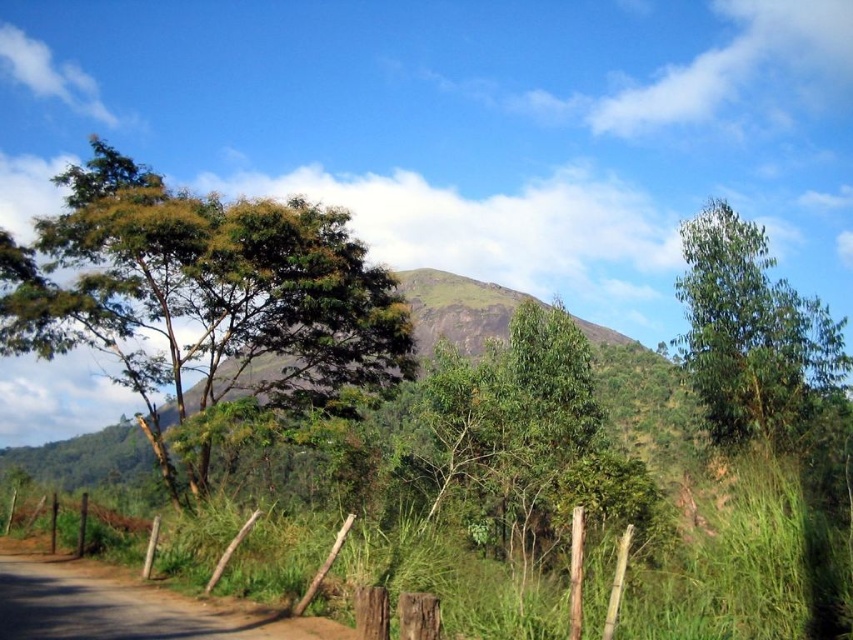
You are a hiker standing at the dirt road at lower left and want to reach the green leafy tree at left. Which direction should you walk to get closer to the tree?

The green leafy tree at left is to the left of dirt road at lower left, so you should walk to your left to get closer to the tree.

You are a hiker standing at the dirt road at lower left and want to take a photo of the green leafy tree at left. Since the tree is much taller than the dirt road, will the tree appear larger in the photo compared to the road?

Yes, the green leafy tree at left is much taller than the dirt road at lower left, so it will appear larger in the photo.